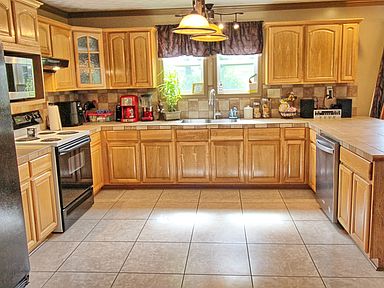
In order to click on ceiling lights in this screenshot , I will do `click(195, 24)`, `click(216, 35)`, `click(221, 25)`, `click(236, 25)`.